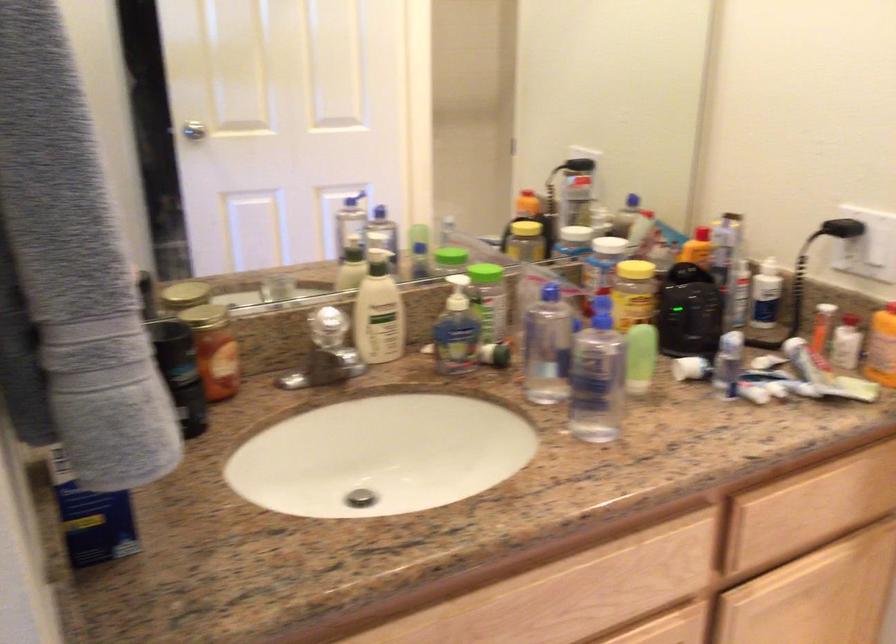
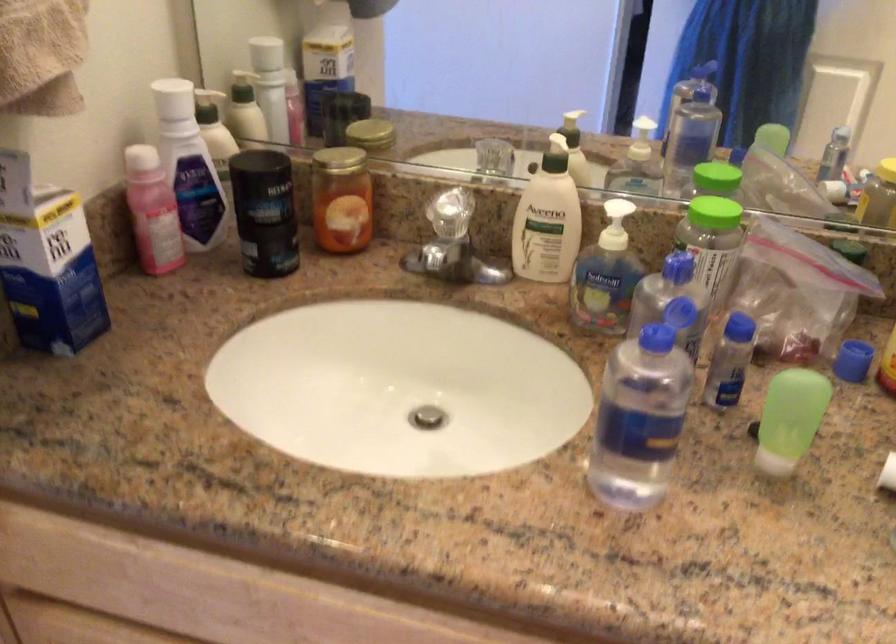
Find the pixel in the second image that matches the point at 218,314 in the first image.

(336, 160)